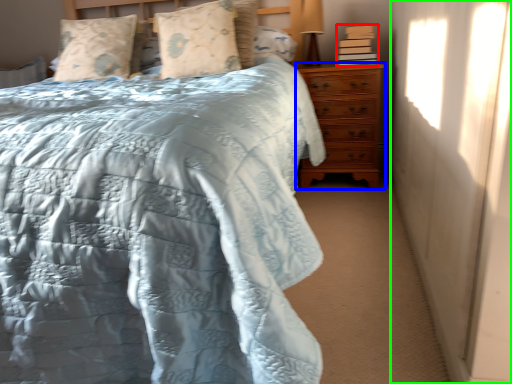
Question: Which is nearer to the book (highlighted by a red box)? chest of drawers (highlighted by a blue box) or curtain (highlighted by a green box).

Choices:
 (A) chest of drawers
 (B) curtain

Answer: (A)